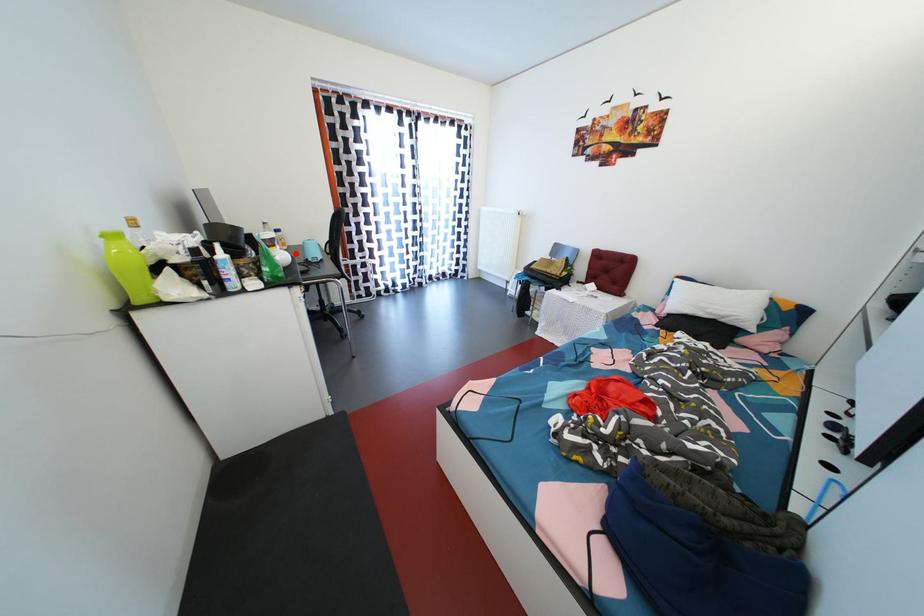
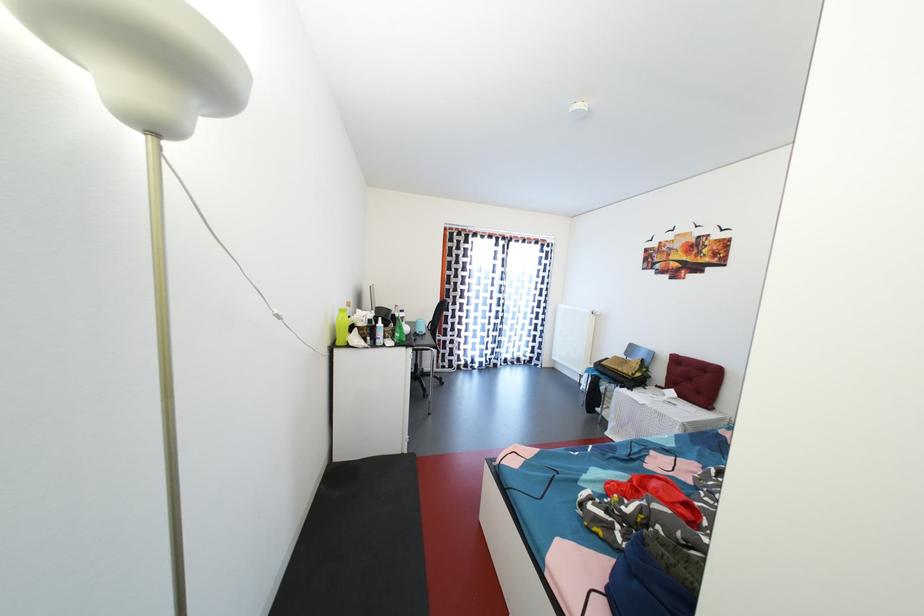
Where in the second image is the point corresponding to the highlighted location from the first image?

(414, 329)